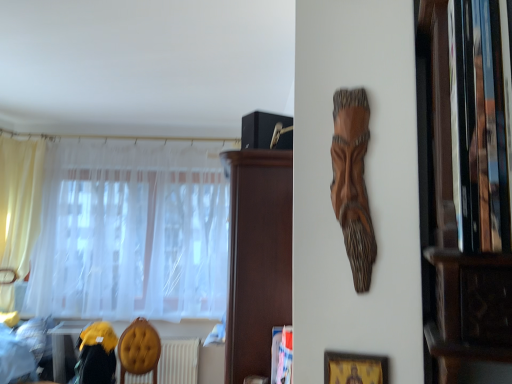
This screenshot has width=512, height=384. What do you see at coordinates (131, 232) in the screenshot?
I see `white sheer curtain at left, the 1th curtain positioned from the right` at bounding box center [131, 232].

The width and height of the screenshot is (512, 384). What do you see at coordinates (352, 182) in the screenshot? I see `wooden carving at upper center` at bounding box center [352, 182].

The width and height of the screenshot is (512, 384). Describe the element at coordinates (63, 344) in the screenshot. I see `yellow fabric at lower left` at that location.

Locate an element on the screen. dark brown wood cabinet at upper center is located at coordinates (258, 258).

I want to click on white sheer curtain at left, arranged as the 2th curtain when viewed from the left, so click(131, 232).

Is there a large distance between white sheer curtain at left, arranged as the 2th curtain when viewed from the left, and yellow fabric armchair at lower left?

white sheer curtain at left, arranged as the 2th curtain when viewed from the left, is near yellow fabric armchair at lower left, not far away.

Measure the distance from white sheer curtain at left, the 1th curtain positioned from the right, to yellow fabric armchair at lower left.

white sheer curtain at left, the 1th curtain positioned from the right, and yellow fabric armchair at lower left are 28.57 inches apart from each other.

From the image's perspective, is white sheer curtain at left, arranged as the 2th curtain when viewed from the left, on top of yellow fabric armchair at lower left?

Correct, white sheer curtain at left, arranged as the 2th curtain when viewed from the left, appears higher than yellow fabric armchair at lower left in the image.

Is white sheer curtain at left, arranged as the 2th curtain when viewed from the left, not inside yellow fabric armchair at lower left?

Yes, white sheer curtain at left, arranged as the 2th curtain when viewed from the left, is located beyond the bounds of yellow fabric armchair at lower left.

Looking at this image, would you consider yellow sheer curtain at left, which appears as the 1th curtain when viewed from the left, to be distant from yellow fabric armchair at lower left?

Yes, yellow sheer curtain at left, which appears as the 1th curtain when viewed from the left, and yellow fabric armchair at lower left are located far from each other.

Is yellow sheer curtain at left, which is the second curtain in right-to-left order, not inside yellow fabric armchair at lower left?

Absolutely, yellow sheer curtain at left, which is the second curtain in right-to-left order, is external to yellow fabric armchair at lower left.

Based on their positions, is yellow sheer curtain at left, which appears as the 1th curtain when viewed from the left, located to the left or right of yellow fabric armchair at lower left?

yellow sheer curtain at left, which appears as the 1th curtain when viewed from the left, is to the left of yellow fabric armchair at lower left.

Is yellow sheer curtain at left, which is the second curtain in right-to-left order, wider than yellow fabric armchair at lower left?

Incorrect, the width of yellow sheer curtain at left, which is the second curtain in right-to-left order, does not surpass that of yellow fabric armchair at lower left.

Can we say white textured radiator at lower center lies outside yellow fabric at lower left?

Yes, white textured radiator at lower center is located beyond the bounds of yellow fabric at lower left.

In the scene shown: Which is closer, (x=130, y=376) or (x=59, y=358)?

Point (x=130, y=376) is farther from the camera than point (x=59, y=358).

Are white textured radiator at lower center and yellow fabric at lower left located far from each other?

That's not correct — white textured radiator at lower center is a little close to yellow fabric at lower left.

Consider the image. Which of these two, white textured radiator at lower center or yellow fabric at lower left, is smaller?

white textured radiator at lower center.

From a real-world perspective, who is located lower, yellow fabric at lower left or dark brown wood cabinet at upper center?

yellow fabric at lower left.

Is yellow fabric at lower left at the left side of dark brown wood cabinet at upper center?

Yes.

Based on the photo, is yellow fabric at lower left directly adjacent to dark brown wood cabinet at upper center?

yellow fabric at lower left is not next to dark brown wood cabinet at upper center, and they're not touching.

How different are the orientations of yellow fabric at lower left and dark brown wood cabinet at upper center in degrees?

99.2 degrees.

Which is more distant, (97, 248) or (111, 346)?

The point (97, 248) is behind.

Which of these two, white sheer curtain at left, the 1th curtain positioned from the right, or velvet yellow swivel chair at lower left, is thinner?

With smaller width is white sheer curtain at left, the 1th curtain positioned from the right.

Does white sheer curtain at left, the 1th curtain positioned from the right, turn towards velvet yellow swivel chair at lower left?

No, white sheer curtain at left, the 1th curtain positioned from the right, is not aimed at velvet yellow swivel chair at lower left.

Which is behind, white sheer curtain at left, the 1th curtain positioned from the right, or velvet yellow swivel chair at lower left?

white sheer curtain at left, the 1th curtain positioned from the right.

Is white sheer curtain at left, the 1th curtain positioned from the right, completely or partially inside wooden carving at upper center?

No, white sheer curtain at left, the 1th curtain positioned from the right, is located outside of wooden carving at upper center.

How many degrees apart are the facing directions of wooden carving at upper center and white sheer curtain at left, arranged as the 2th curtain when viewed from the left?

wooden carving at upper center and white sheer curtain at left, arranged as the 2th curtain when viewed from the left, are facing 19.4 degrees away from each other.

Considering the sizes of wooden carving at upper center and white sheer curtain at left, the 1th curtain positioned from the right, in the image, is wooden carving at upper center bigger or smaller than white sheer curtain at left, the 1th curtain positioned from the right,?

Considering their sizes, wooden carving at upper center takes up less space than white sheer curtain at left, the 1th curtain positioned from the right.

In the scene shown: Which is more to the left, wooden carving at upper center or white sheer curtain at left, the 1th curtain positioned from the right?

From the viewer's perspective, white sheer curtain at left, the 1th curtain positioned from the right, appears more on the left side.

In the image, is yellow fabric armchair at lower left on the left side or the right side of yellow sheer curtain at left, which is the second curtain in right-to-left order?

yellow fabric armchair at lower left is positioned on yellow sheer curtain at left, which is the second curtain in right-to-left order,'s right side.

Does yellow fabric armchair at lower left have a smaller size compared to yellow sheer curtain at left, which is the second curtain in right-to-left order?

Correct, yellow fabric armchair at lower left occupies less space than yellow sheer curtain at left, which is the second curtain in right-to-left order.

Would you say yellow fabric armchair at lower left is a long distance from yellow sheer curtain at left, which is the second curtain in right-to-left order?

Yes, yellow fabric armchair at lower left is far from yellow sheer curtain at left, which is the second curtain in right-to-left order.

Is yellow fabric armchair at lower left oriented towards yellow sheer curtain at left, which is the second curtain in right-to-left order?

No, yellow fabric armchair at lower left is not facing towards yellow sheer curtain at left, which is the second curtain in right-to-left order.

Find the location of a particular element. The height and width of the screenshot is (384, 512). the 2nd curtain behind the yellow fabric armchair at lower left, counting from the anchor's position is located at coordinates (131, 232).

From a real-world perspective, which curtain is the 1st one above the yellow fabric armchair at lower left? Please provide its 2D coordinates.

[(18, 210)]

Which object lies nearer to the anchor point gold textured picture frame at lower right, yellow fabric armchair at lower left or white sheer curtain at left, the 1th curtain positioned from the right?

Among the two, yellow fabric armchair at lower left is located nearer to gold textured picture frame at lower right.

When comparing their distances from yellow fabric armchair at lower left, does wooden carving at upper center or white textured radiator at lower center seem further?

wooden carving at upper center is further to yellow fabric armchair at lower left.

Which object lies nearer to the anchor point white sheer curtain at left, the 1th curtain positioned from the right, white textured radiator at lower center or gold textured picture frame at lower right?

white textured radiator at lower center is closer to white sheer curtain at left, the 1th curtain positioned from the right.

When comparing their distances from dark brown wood cabinet at upper center, does yellow fabric at lower left or gold textured picture frame at lower right seem closer?

gold textured picture frame at lower right.

Looking at the image, which one is located closer to yellow fabric at lower left, yellow sheer curtain at left, which is the second curtain in right-to-left order, or wooden carving at upper center?

yellow sheer curtain at left, which is the second curtain in right-to-left order, is positioned closer to the anchor yellow fabric at lower left.

Estimate the real-world distances between objects in this image. Which object is further from yellow sheer curtain at left, which appears as the 1th curtain when viewed from the left, velvet yellow swivel chair at lower left or white sheer curtain at left, arranged as the 2th curtain when viewed from the left?

velvet yellow swivel chair at lower left is further to yellow sheer curtain at left, which appears as the 1th curtain when viewed from the left.

Considering their positions, is white textured radiator at lower center positioned closer to yellow fabric armchair at lower left than wooden carving at upper center?

Among the two, white textured radiator at lower center is located nearer to yellow fabric armchair at lower left.

Estimate the real-world distances between objects in this image. Which object is closer to yellow fabric armchair at lower left, yellow fabric at lower left or yellow sheer curtain at left, which is the second curtain in right-to-left order?

yellow fabric at lower left lies closer to yellow fabric armchair at lower left than the other object.

Find the location of a particular element. The image size is (512, 384). armchair between wooden carving at upper center and yellow fabric at lower left in the front-back direction is located at coordinates (139, 349).

The image size is (512, 384). I want to click on curtain positioned between gold textured picture frame at lower right and white sheer curtain at left, arranged as the 2th curtain when viewed from the left, from near to far, so click(18, 210).

Identify the location of armchair between velvet yellow swivel chair at lower left and white textured radiator at lower center in the front-back direction. The width and height of the screenshot is (512, 384). (139, 349).

Locate an element on the screen. The width and height of the screenshot is (512, 384). cabinetry positioned between wooden carving at upper center and white sheer curtain at left, the 1th curtain positioned from the right, from near to far is located at coordinates (258, 258).